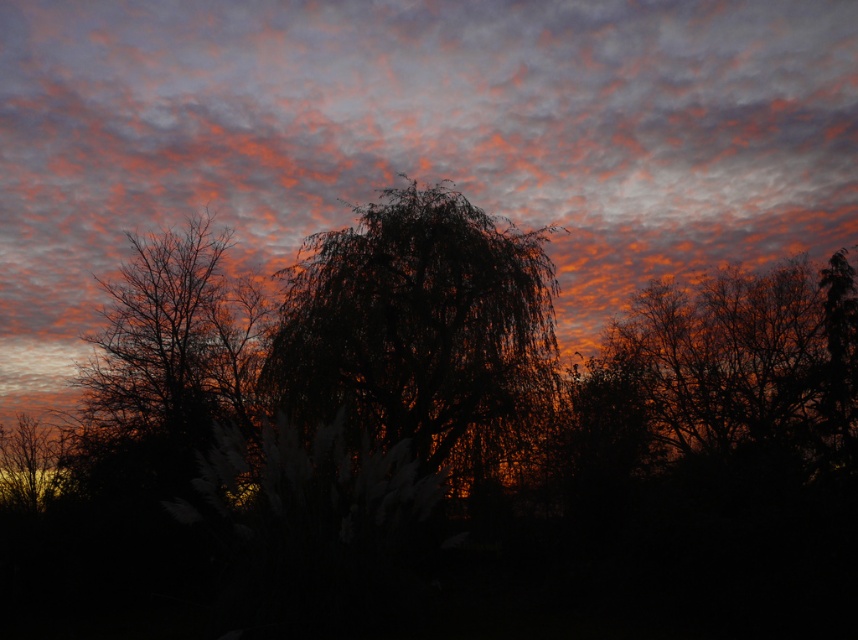
Between dark matte tree at center and silhouette tree at left, which one is positioned lower?

dark matte tree at center is lower down.

Does dark matte tree at center have a larger size compared to silhouette tree at left?

No, dark matte tree at center is not bigger than silhouette tree at left.

Does point (494, 410) lie in front of point (194, 282)?

Yes, it is in front of point (194, 282).

At what (x,y) coordinates should I click in order to perform the action: click on dark matte tree at center. Please return your answer as a coordinate pair (x, y). The image size is (858, 640). Looking at the image, I should click on (420, 332).

Between orange matte cloud at upper center and silhouette tree at right, which one has less height?

With less height is silhouette tree at right.

Does orange matte cloud at upper center have a greater height compared to silhouette tree at right?

Correct, orange matte cloud at upper center is much taller as silhouette tree at right.

Between point (257, 156) and point (840, 445), which one is positioned behind?

Point (257, 156)

Where is `orange matte cloud at upper center`? This screenshot has height=640, width=858. orange matte cloud at upper center is located at coordinates (414, 140).

Measure the distance between dark matte tree at center and silhouette tree at right.

dark matte tree at center and silhouette tree at right are 6.96 meters apart.

Is dark matte tree at center further to the viewer compared to silhouette tree at right?

That is True.

The image size is (858, 640). What are the coordinates of `dark matte tree at center` in the screenshot? It's located at (420, 332).